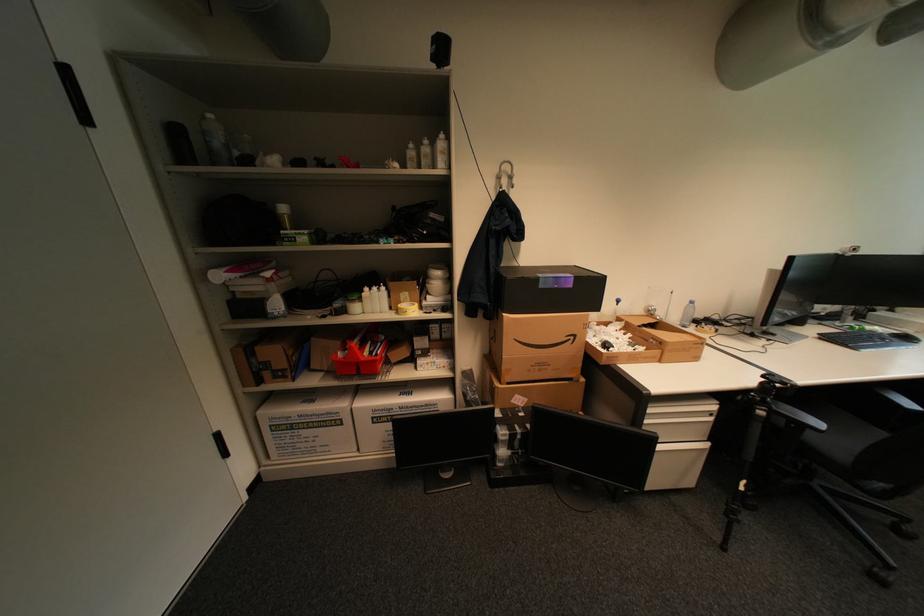
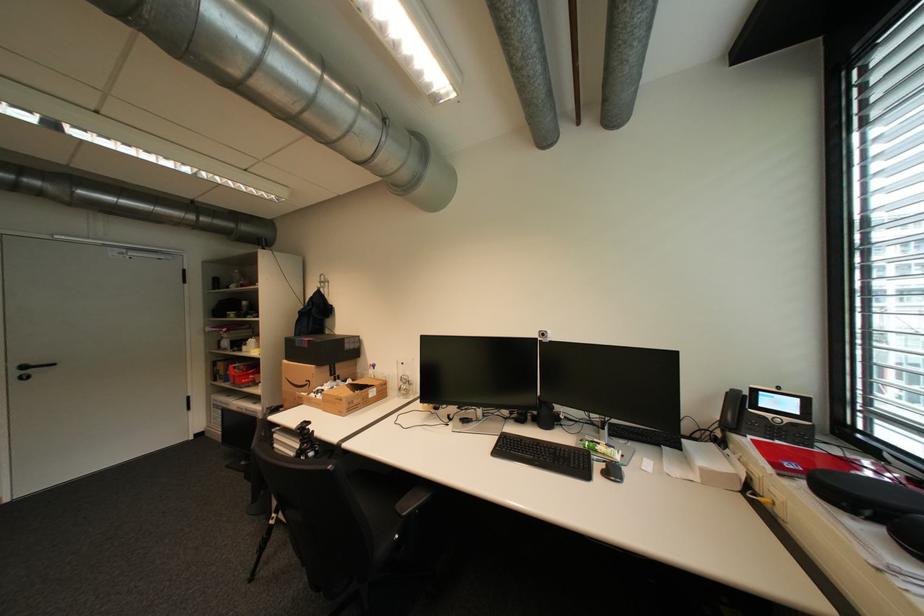
Locate, in the second image, the point that corresponds to the point at 580,338 in the first image.

(317, 383)